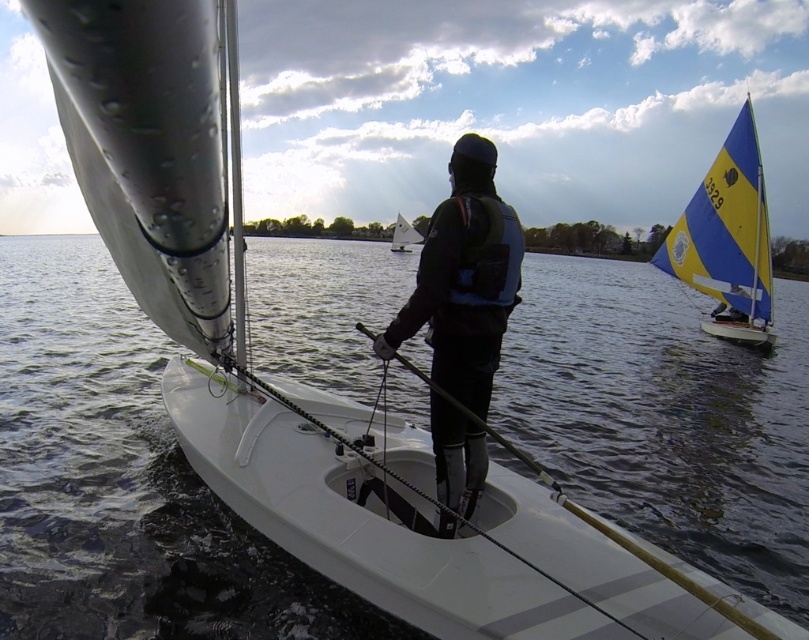
Question: Which object is closer to the camera taking this photo?

Choices:
 (A) blue/yellow sailboat at right
 (B) dark blue wetsuit at center

Answer: (B)

Question: Which object is closer to the camera taking this photo?

Choices:
 (A) dark blue wetsuit at center
 (B) white matte sailboat at center

Answer: (A)

Question: Observing the image, what is the correct spatial positioning of dark blue wetsuit at center in reference to blue/yellow sailboat at right?

Choices:
 (A) left
 (B) right

Answer: (A)

Question: Observing the image, what is the correct spatial positioning of blue/yellow sailboat at right in reference to white matte sailboat at center?

Choices:
 (A) left
 (B) right

Answer: (B)

Question: Can you confirm if dark blue wetsuit at center is wider than blue/yellow sailboat at right?

Choices:
 (A) yes
 (B) no

Answer: (B)

Question: Which point is farther to the camera?

Choices:
 (A) white matte sailboat at center
 (B) blue/yellow sailboat at right

Answer: (A)